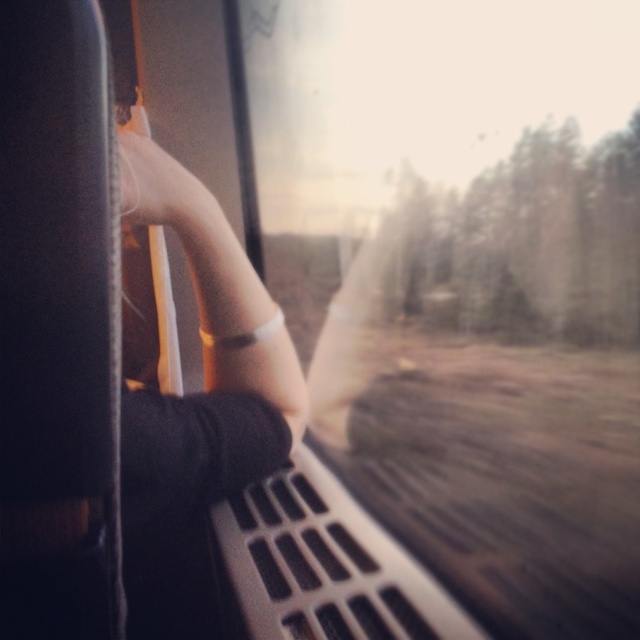
This screenshot has width=640, height=640. What do you see at coordinates (448, 317) in the screenshot?
I see `transparent glass train window at center` at bounding box center [448, 317].

Measure the distance from transparent glass train window at center to matte white hand at upper left.

transparent glass train window at center and matte white hand at upper left are 33.74 centimeters apart.

Does point (404, 221) lie behind point (134, 136)?

Yes, point (404, 221) is farther from viewer.

You are a GUI agent. You are given a task and a screenshot of the screen. Output one action in this format:
    pyautogui.click(x=<x>, y=<y>)
    Task: Click on the transparent glass train window at center
    The image size is (640, 640).
    Given the screenshot: What is the action you would take?
    pyautogui.click(x=448, y=317)